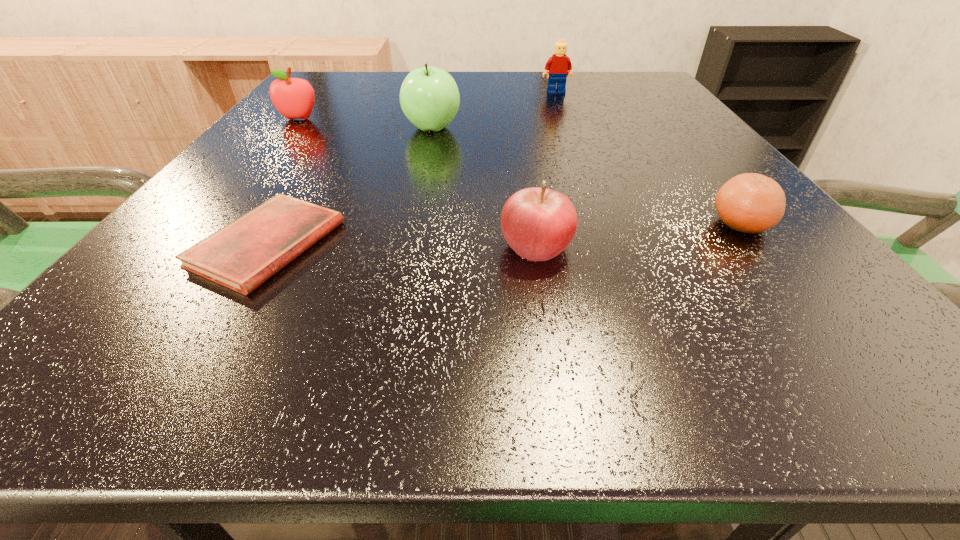
I want to click on the third object from left to right, so click(x=429, y=97).

Where is `the farthest object`? This screenshot has width=960, height=540. the farthest object is located at coordinates (559, 64).

Where is `Lego`? This screenshot has height=540, width=960. Lego is located at coordinates (559, 64).

Locate an element on the screen. This screenshot has width=960, height=540. the leftmost apple is located at coordinates (294, 98).

Find the location of a particular element. Image resolution: width=960 pixels, height=540 pixels. the nearest apple is located at coordinates (538, 223).

Where is `the rightmost apple`? The height and width of the screenshot is (540, 960). the rightmost apple is located at coordinates (538, 223).

Locate an element on the screen. the rightmost object is located at coordinates (752, 203).

Locate an element on the screen. The height and width of the screenshot is (540, 960). the fifth tallest object is located at coordinates (752, 203).

This screenshot has width=960, height=540. Identify the location of diary. (242, 255).

Locate an element on the screen. vacant space located 0.200m on the front of the second apple from right to left is located at coordinates (418, 198).